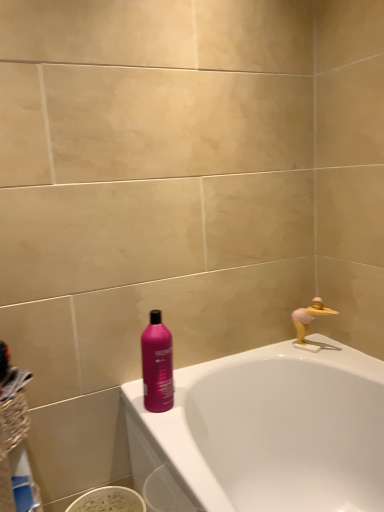
You are a GUI agent. You are given a task and a screenshot of the screen. Output one action in this format:
    pyautogui.click(x=<x>, y=<y>)
    Task: Click on the vacant region in front of yellow rubber duck at upper right
    
    Given the screenshot: What is the action you would take?
    tap(339, 361)